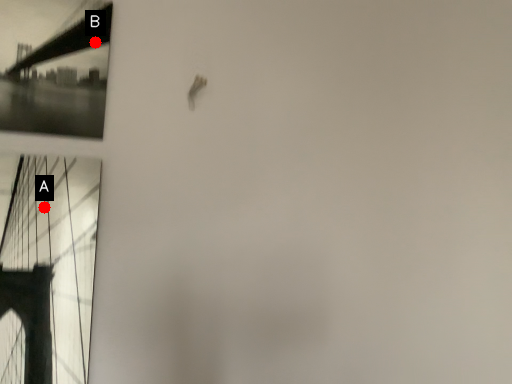
Question: Two points are circled on the image, labeled by A and B beside each circle. Which point is farther to the camera?

Choices:
 (A) A is further
 (B) B is further

Answer: (B)